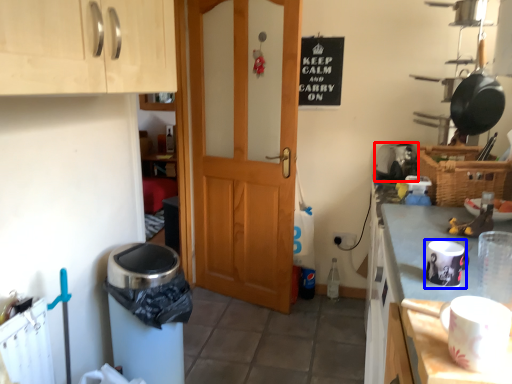
Question: Among these objects, which one is nearest to the camera, appliance (highlighted by a red box) or appliance (highlighted by a blue box)?

Choices:
 (A) appliance
 (B) appliance

Answer: (B)